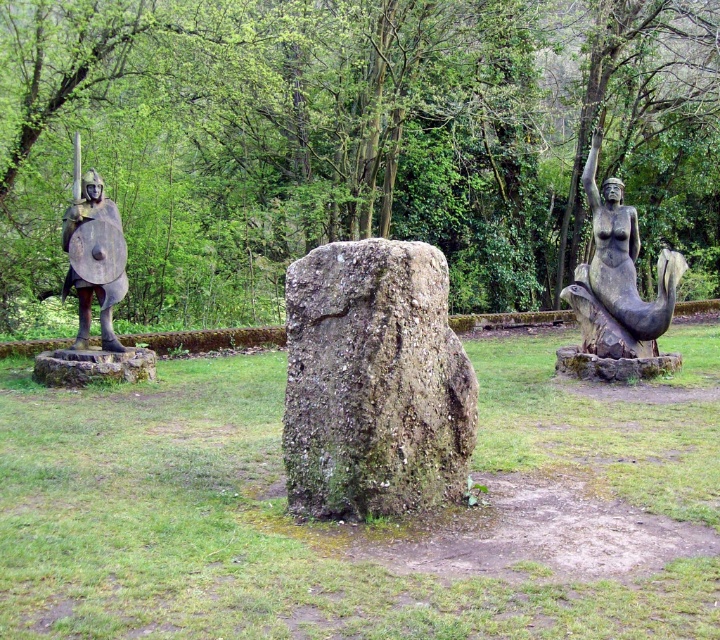
You are a visitor in the park and want to take a photo of both the green mossy rock at center and the bronze mermaid at right. Which object should you focus on first to ensure both are in the frame?

You should focus on the green mossy rock at center first since it is closer to you than the bronze mermaid at right, allowing both to be in the frame by adjusting the camera angle or zoom.

You are a tour guide leading a group through the park and want to highlight the spacing between the bronze mermaid at right and bronze warrior at left. How far apart are they?

The bronze mermaid at right is 5.07 meters away from the bronze warrior at left.

Consider the image. You are a landscape architect designing a garden path that needs to pass between the green mossy rock at center and the bronze mermaid at right. The path must be at least 1 meter wide to accommodate visitors. Can the path be safely placed between them based on their sizes?

The green mossy rock at center is thinner than the bronze mermaid at right, so the path can be safely placed between them as the rock is narrower, allowing enough space for the 1 meter wide path.